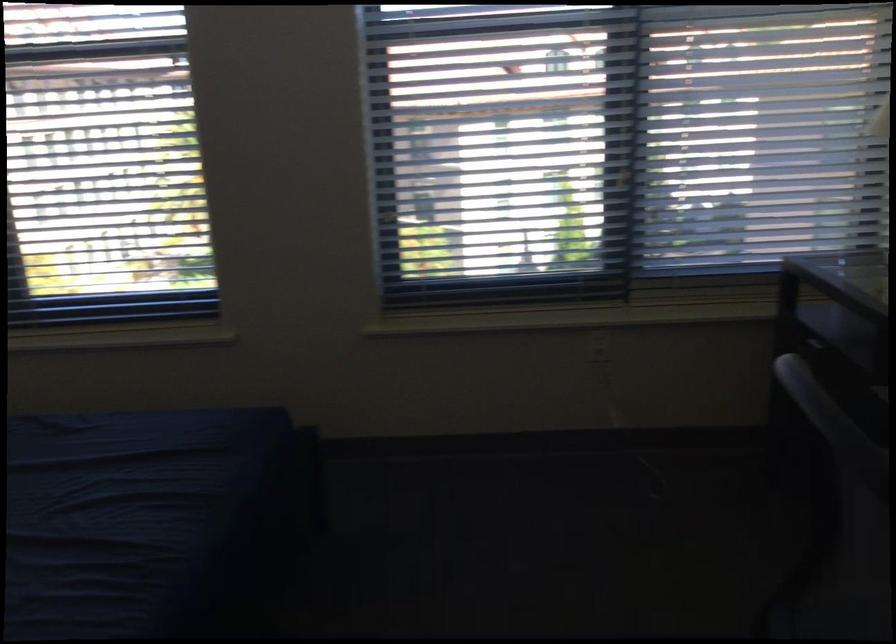
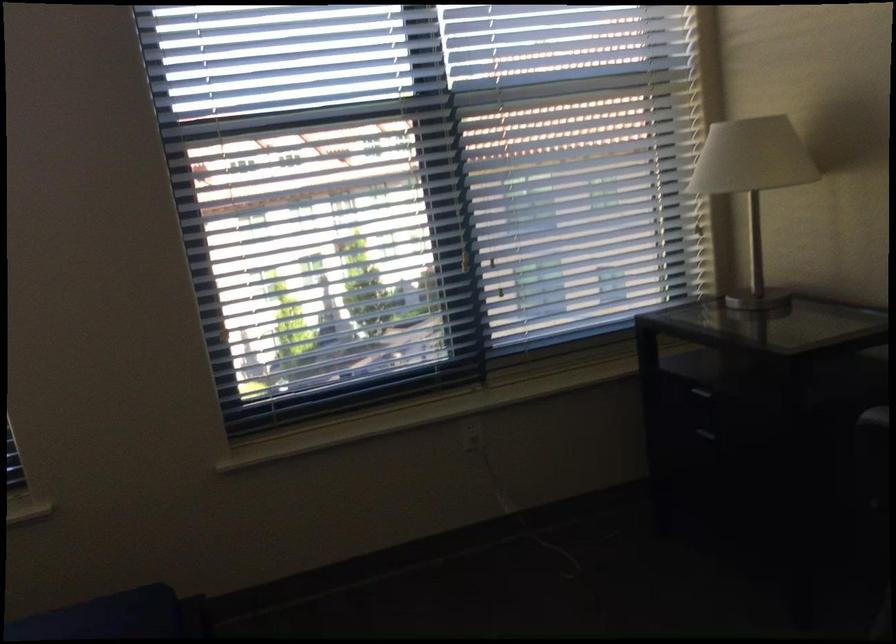
In a continuous first-person perspective shot, in which direction is the camera moving?

The movement direction of the cameraman is left, forward.